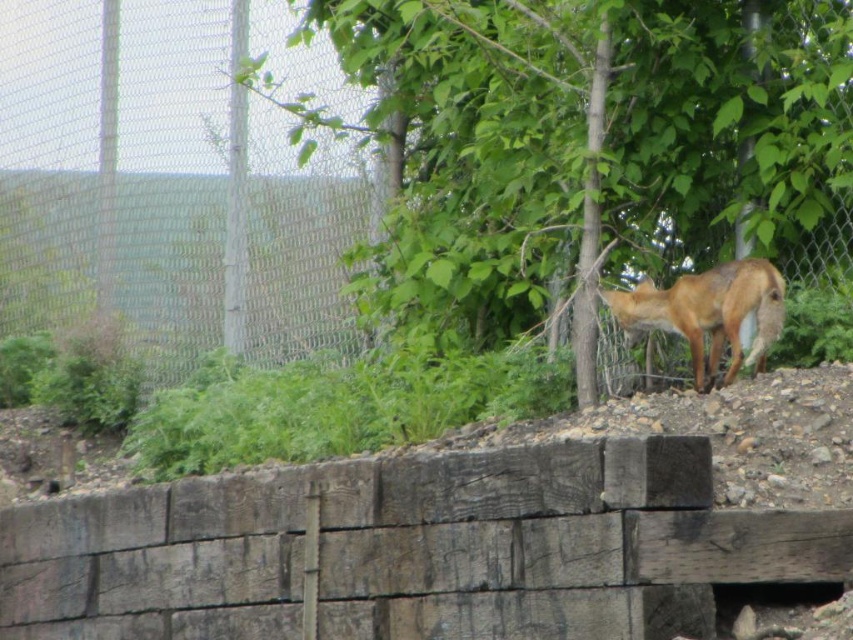
Between green leafy tree at right and brown fur fox at center, which one has more height?

Standing taller between the two is green leafy tree at right.

Can you confirm if green leafy tree at right is positioned to the right of brown fur fox at center?

Incorrect, green leafy tree at right is not on the right side of brown fur fox at center.

Is point (666, 147) closer to camera compared to point (711, 268)?

No.

I want to click on green leafy tree at right, so click(581, 138).